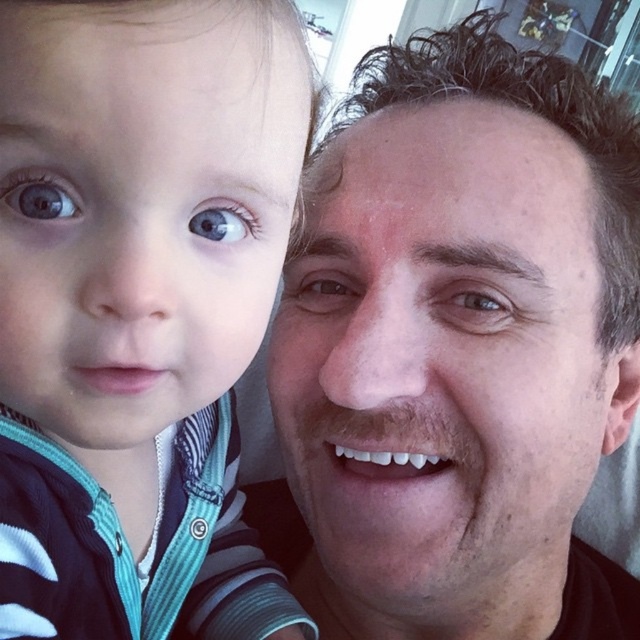
You are a photographer trying to focus on the blue glossy eye at left and the blue matte eye at center in this selfie. Which eye should you adjust your camera to focus on first if you want to start from the left side of the frame?

The blue glossy eye at left is on the left side of the frame, so you should focus on the blue glossy eye at left first before moving to the blue matte eye at center which is positioned to its right.

You are taking a photo of two people in a room. You notice two points in the image at coordinates point (476, 100) and point (502, 310). Which point is closer to the camera?

Point (476, 100) is further to the camera than point (502, 310), so the closer point to the camera is point (502, 310).

You are taking a photo of two people in a room and want to focus on the person closer to the camera. Which point should you focus on, point (536, 452) or point (28, 179)?

Point (536, 452) is further to the camera than point (28, 179), so you should focus on point (536, 452) to capture the person closer to the camera.